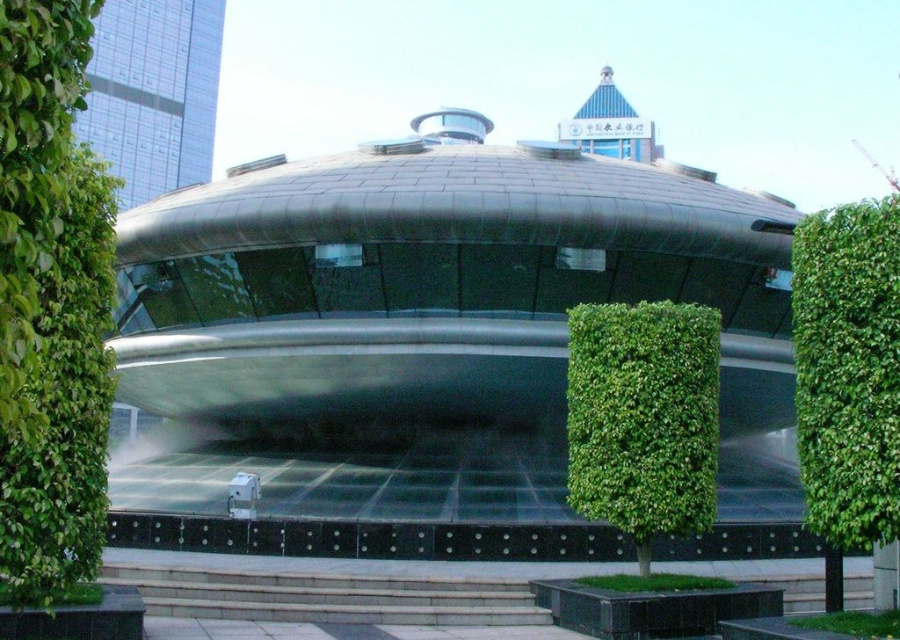
Who is positioned more to the right, green leafy bush at center or green leafy hedge at center?

From the viewer's perspective, green leafy bush at center appears more on the right side.

Who is more distant from viewer, (826,230) or (609,381)?

Point (609,381)

Locate an element on the screen. green leafy bush at center is located at coordinates (848, 371).

Locate an element on the screen. green leafy bush at center is located at coordinates (848, 371).

Does green leafy tree at left have a greater width compared to green leafy hedge at center?

Yes.

Who is positioned more to the left, green leafy tree at left or green leafy hedge at center?

green leafy tree at left is more to the left.

Which is in front, point (25, 508) or point (658, 392)?

Point (25, 508) is in front.

Where is `green leafy tree at left`? This screenshot has width=900, height=640. green leafy tree at left is located at coordinates (50, 305).

Can you confirm if green leafy tree at left is smaller than green leafy bush at center?

Indeed, green leafy tree at left has a smaller size compared to green leafy bush at center.

Between point (0, 220) and point (873, 262), which one is positioned behind?

The point (873, 262) is more distant.

Where is `green leafy tree at left`? green leafy tree at left is located at coordinates (50, 305).